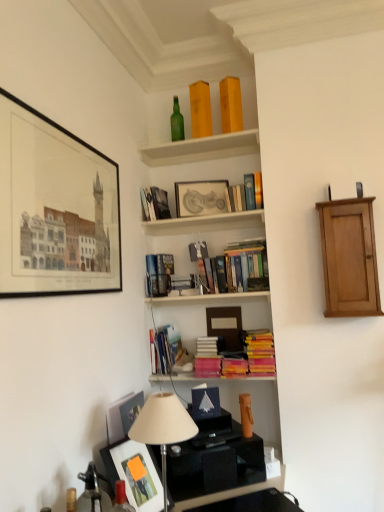
Question: In terms of size, does hardcover books at center, which is counted as the ninth book, starting from the top, appear bigger or smaller than hardcover book at upper center, the fourth book positioned from the top?

Choices:
 (A) small
 (B) big

Answer: (B)

Question: From a real-world perspective, is hardcover books at center, which is counted as the ninth book, starting from the top, above or below hardcover book at upper center, the fourth book positioned from the top?

Choices:
 (A) below
 (B) above

Answer: (A)

Question: Which of these objects is positioned closest to the green glass bottle at upper center?

Choices:
 (A) matte silver picture frame at center, acting as the first picture frame starting from the right
 (B) hardcover books at center, which is the 6th book from top to bottom
 (C) hardcover book at upper center, which is the 7th book in bottom-to-top order
 (D) yellow matte stack of books at center, the 3th book when ordered from bottom to top
 (E) wooden books at center, the second shelf in the top-to-bottom sequence

Answer: (A)

Question: Which object is positioned farthest from the hardcover book at center, which is the 4th book in bottom-to-top order?

Choices:
 (A) wooden books at center, the second shelf in the top-to-bottom sequence
 (B) light brown wood cabinet at right
 (C) hardcover books at center, which is the sixth book from bottom to top
 (D) hardcover books at center, which is the 6th book from top to bottom
 (E) hardcover books at center, placed as the tenth book when sorted from top to bottom

Answer: (B)